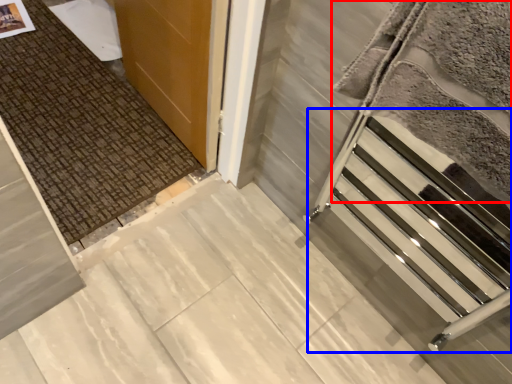
Question: Which of the following is the farthest to the observer, blanket (highlighted by a red box) or stairwell (highlighted by a blue box)?

Choices:
 (A) blanket
 (B) stairwell

Answer: (B)